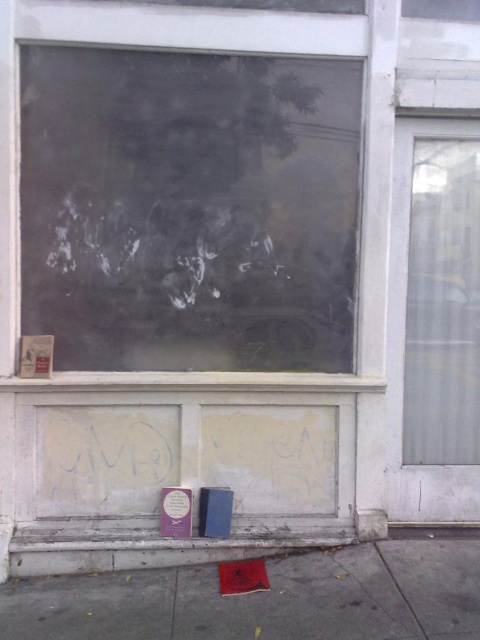
Question: Is smooth concrete pavement at lower center further to the viewer compared to transparent glass window at right?

Choices:
 (A) yes
 (B) no

Answer: (B)

Question: Can you confirm if transparent glass window at right is thinner than transparent glass window at center?

Choices:
 (A) no
 (B) yes

Answer: (B)

Question: Which object appears farthest from the camera in this image?

Choices:
 (A) transparent glass window at center
 (B) transparent glass window at right

Answer: (B)

Question: Which of the following is the farthest from the observer?

Choices:
 (A) (326, 40)
 (B) (394, 244)
 (C) (361, 637)

Answer: (B)

Question: Does smooth concrete pavement at lower center appear on the left side of transparent glass window at right?

Choices:
 (A) no
 (B) yes

Answer: (B)

Question: Which is nearer to the smooth concrete pavement at lower center?

Choices:
 (A) transparent glass window at center
 (B) transparent glass window at right

Answer: (B)